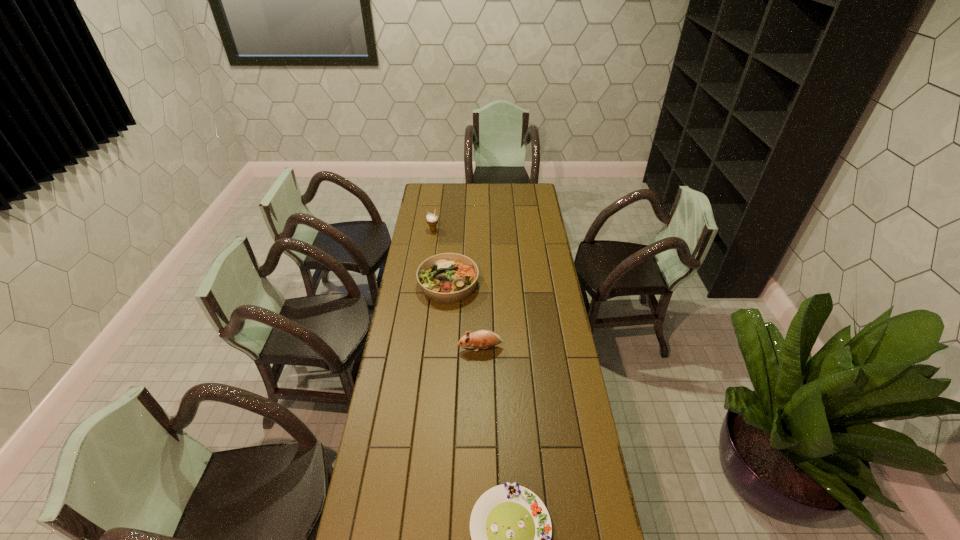
This screenshot has height=540, width=960. Find the location of `icecream that is at the left edge`. icecream that is at the left edge is located at coordinates (432, 219).

Identify the location of salad plate that is at the left edge. This screenshot has width=960, height=540. (446, 278).

Locate an element on the screen. vacant space at the far edge of the desktop is located at coordinates (x=476, y=185).

In order to click on blank space at the left edge of the desktop in this screenshot , I will do `click(419, 215)`.

The width and height of the screenshot is (960, 540). I want to click on vacant space at the right edge, so pos(518,205).

This screenshot has width=960, height=540. I want to click on unoccupied area between the farther salad plate and the second nearest object, so click(x=465, y=316).

Choose which object is the nearest neighbor to the nearer salad plate. Please provide its 2D coordinates. Your answer should be formatted as a tuple, i.e. [(x, y)], where the tuple contains the x and y coordinates of a point satisfying the conditions above.

[(484, 339)]

The image size is (960, 540). Identify the location of object that stands as the second closest to the shortest object. 446,278.